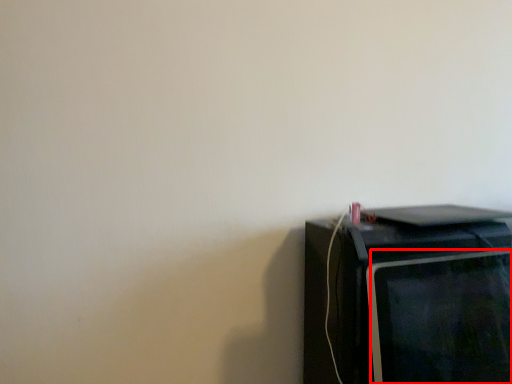
Question: From the image, what is the correct spatial relationship of computer monitor (annotated by the red box) in relation to home appliance?

Choices:
 (A) left
 (B) right

Answer: (B)